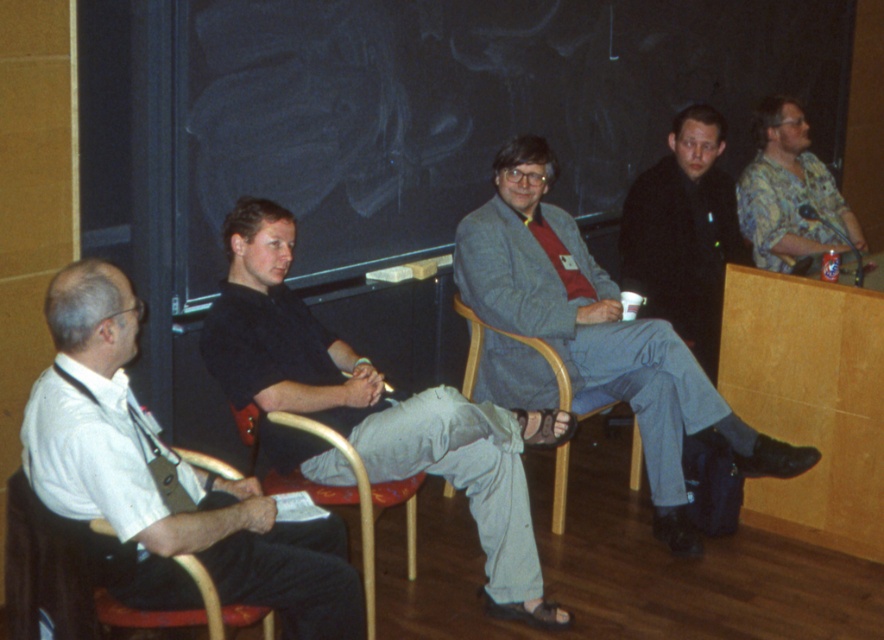
Question: Which of the following is the closest to the observer?

Choices:
 (A) (484, 493)
 (B) (395, 211)

Answer: (A)

Question: Is gray woolen blazer at center below hawaiian shirt at upper right?

Choices:
 (A) no
 (B) yes

Answer: (B)

Question: Considering the relative positions of blackboard at upper center and wooden chair at center in the image provided, where is blackboard at upper center located with respect to wooden chair at center?

Choices:
 (A) above
 (B) below

Answer: (A)

Question: Which object appears farthest from the camera in this image?

Choices:
 (A) gray woolen blazer at center
 (B) dark gray suit at center

Answer: (B)

Question: Which object is positioned farthest from the black cotton shirt at center?

Choices:
 (A) wooden chair at center
 (B) blackboard at upper center
 (C) gray woolen blazer at center

Answer: (B)

Question: Does dark gray suit at center have a lesser width compared to wooden chair at center?

Choices:
 (A) yes
 (B) no

Answer: (A)